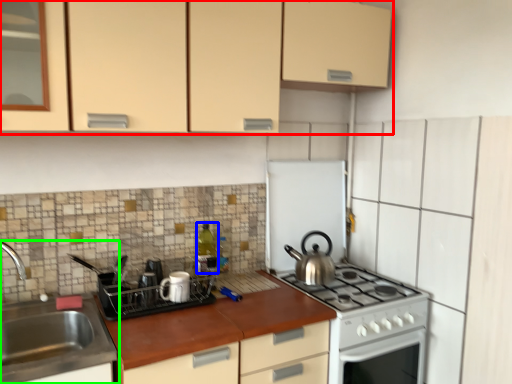
Question: Which object is the farthest from cabinetry (highlighted by a red box)? Choose among these: bottle (highlighted by a blue box) or sink (highlighted by a green box).

Choices:
 (A) bottle
 (B) sink

Answer: (B)